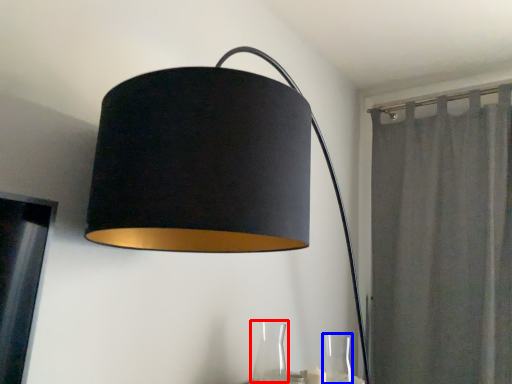
Question: Among these objects, which one is farthest to the camera, glass vase (highlighted by a red box) or glass vase (highlighted by a blue box)?

Choices:
 (A) glass vase
 (B) glass vase

Answer: (B)